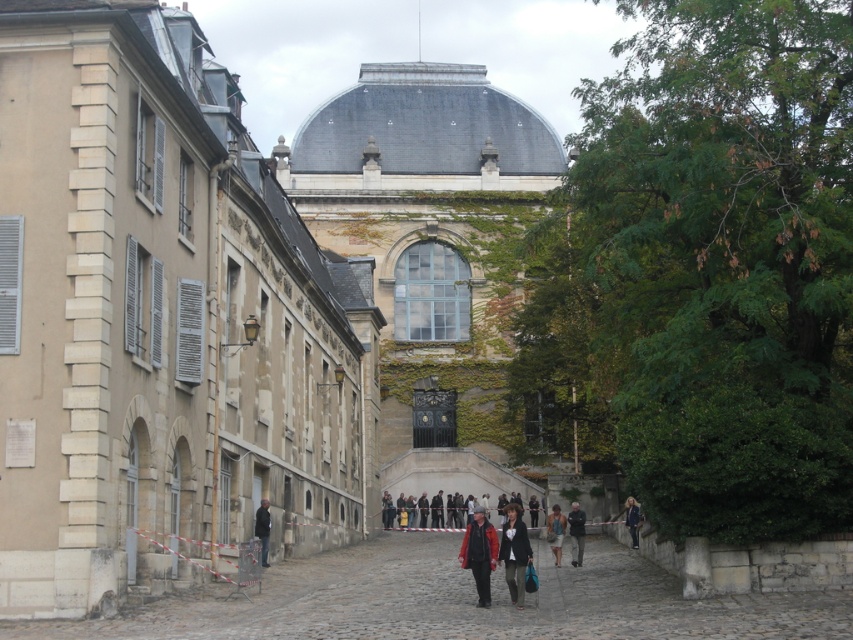
Question: Where is green ivy-covered stone palace at center located in relation to dark blue jacket at center in the image?

Choices:
 (A) right
 (B) left

Answer: (B)

Question: Among these objects, which one is nearest to the camera?

Choices:
 (A) dark brown leather jacket at lower right
 (B) green ivy-covered stone palace at center

Answer: (A)

Question: Does green ivy-covered stone palace at center have a smaller size compared to dark brown leather jacket at lower right?

Choices:
 (A) no
 (B) yes

Answer: (A)

Question: Which is nearer to the green ivy-covered stone palace at center?

Choices:
 (A) denim jacket at lower center
 (B) dark brown leather jacket at lower right

Answer: (A)

Question: Is green ivy-covered stone palace at center smaller than dark brown leather jacket at center?

Choices:
 (A) yes
 (B) no

Answer: (B)

Question: Among these points, which one is nearest to the camera?

Choices:
 (A) (633, 540)
 (B) (572, 515)
 (C) (471, 531)

Answer: (C)